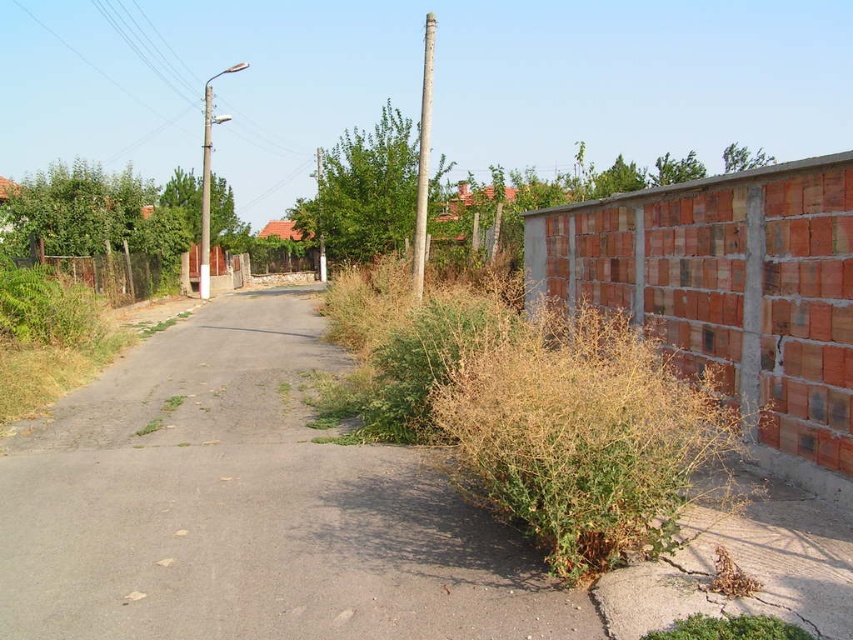
Question: Is the position of gray asphalt driveway at center more distant than that of green leafy tree at center?

Choices:
 (A) yes
 (B) no

Answer: (B)

Question: Which point is farther from the camera taking this photo?

Choices:
 (A) (329, 173)
 (B) (126, 552)

Answer: (A)

Question: Is gray asphalt driveway at center thinner than green leafy tree at center?

Choices:
 (A) no
 (B) yes

Answer: (B)

Question: Is gray asphalt driveway at center thinner than green leafy tree at center?

Choices:
 (A) no
 (B) yes

Answer: (B)

Question: Which object appears farthest from the camera in this image?

Choices:
 (A) green leafy tree at center
 (B) gray asphalt driveway at center

Answer: (A)